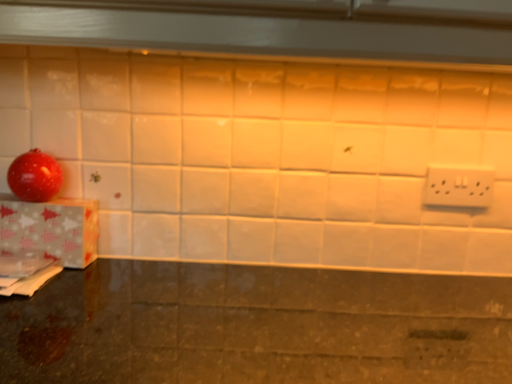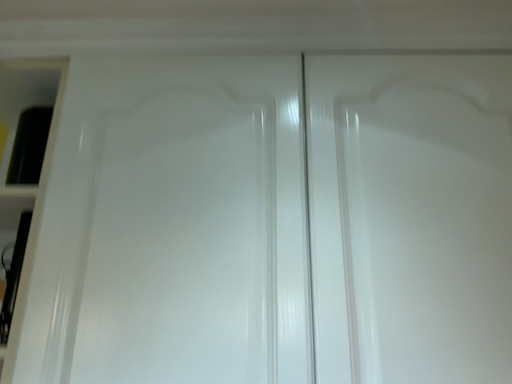
Question: How did the camera likely rotate when shooting the video?

Choices:
 (A) rotated downward
 (B) rotated upward

Answer: (B)